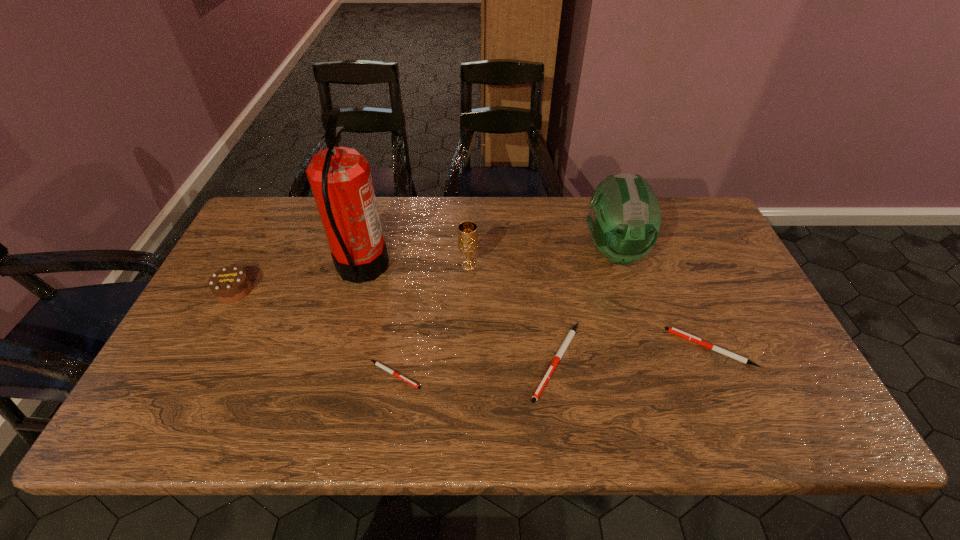
Locate an element on the screen. The height and width of the screenshot is (540, 960). fire extinguisher present at the far edge is located at coordinates (340, 178).

This screenshot has width=960, height=540. Identify the location of football helmet positioned at the far edge. (624, 220).

At what (x,y) coordinates should I click in order to perform the action: click on object located at the left edge. Please return your answer as a coordinate pair (x, y). The width and height of the screenshot is (960, 540). Looking at the image, I should click on (230, 284).

I want to click on object located at the right edge, so click(x=675, y=331).

The height and width of the screenshot is (540, 960). I want to click on object at the near right corner, so click(x=675, y=331).

In the image, there is a desktop. What are the coordinates of `vacant space at the far edge` in the screenshot? It's located at (508, 219).

Where is `vacant space at the near edge of the desktop`? This screenshot has width=960, height=540. vacant space at the near edge of the desktop is located at coordinates (357, 373).

The height and width of the screenshot is (540, 960). Find the location of `vacant space at the left edge of the desktop`. vacant space at the left edge of the desktop is located at coordinates (180, 354).

Identify the location of free location at the right edge. This screenshot has width=960, height=540. (735, 276).

At what (x,y) coordinates should I click in order to perform the action: click on free region at the far left corner of the desktop. Please return your answer as a coordinate pair (x, y). Image resolution: width=960 pixels, height=540 pixels. Looking at the image, I should click on [x=261, y=228].